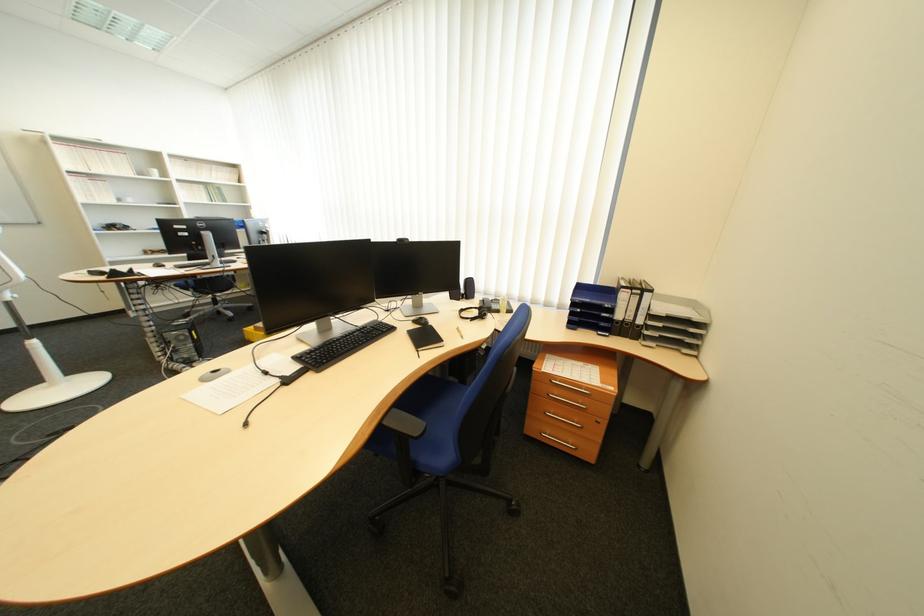
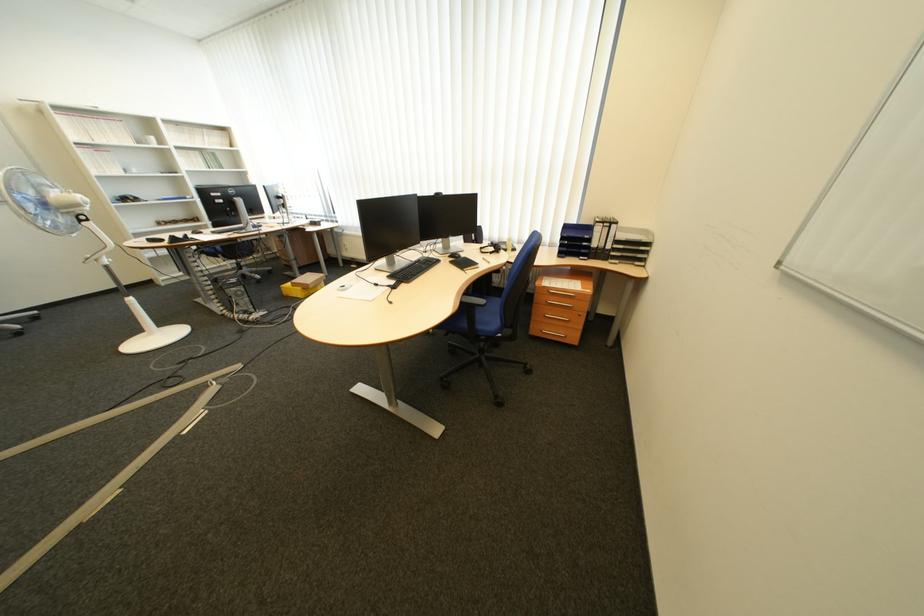
In the second image, find the point that corresponds to the point at 591,312 in the first image.

(579, 244)